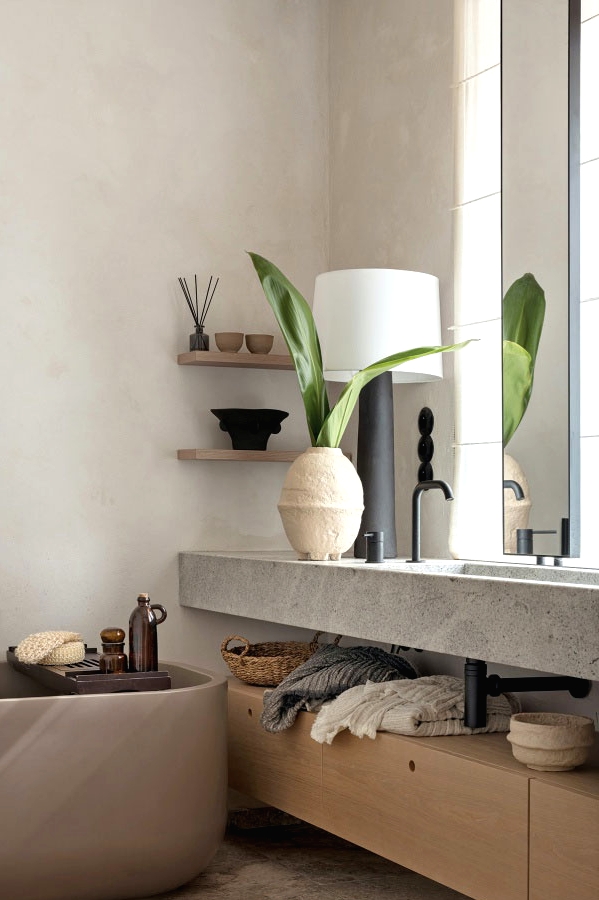
Locate an element on the screen. pair of bowls is located at coordinates (235, 338), (263, 339).